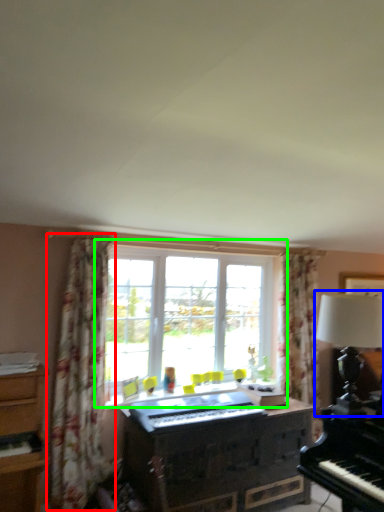
Question: Which object is positioned closest to curtain (highlighted by a red box)? Select from table lamp (highlighted by a blue box) and window (highlighted by a green box).

Choices:
 (A) table lamp
 (B) window

Answer: (B)